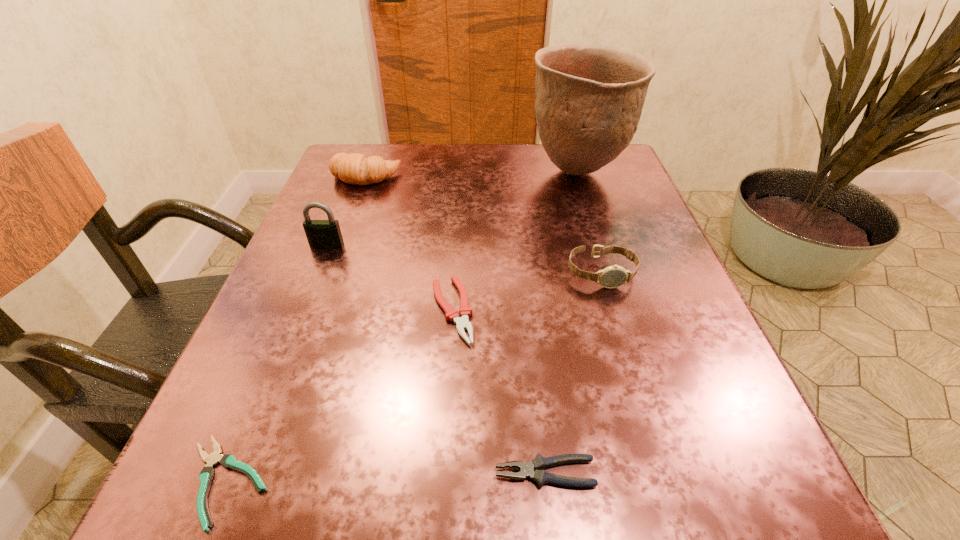
The width and height of the screenshot is (960, 540). In the image, there is a desktop. Find the location of `free space at the left edge`. free space at the left edge is located at coordinates (290, 318).

The width and height of the screenshot is (960, 540). In the image, there is a desktop. Identify the location of vacant space at the right edge. point(576,227).

The width and height of the screenshot is (960, 540). In the image, there is a desktop. Find the location of `vacant space at the far left corner`. vacant space at the far left corner is located at coordinates pyautogui.click(x=330, y=192).

Identify the location of vacant position at the far right corner of the desktop. (629, 192).

Locate an element on the screen. vacant region at the near right corner of the desktop is located at coordinates (746, 515).

The image size is (960, 540). What are the coordinates of `unoccupied area between the fourth shortest object and the third tallest object` in the screenshot? It's located at pyautogui.click(x=484, y=225).

Locate an element on the screen. The width and height of the screenshot is (960, 540). empty space that is in between the padlock and the fourth tallest object is located at coordinates (464, 259).

Locate an element on the screen. vacant area between the leftmost pliers and the crescent roll is located at coordinates (296, 329).

Where is `vacant point located between the shortest pliers and the second pliers from right to left`? The image size is (960, 540). vacant point located between the shortest pliers and the second pliers from right to left is located at coordinates (339, 396).

The image size is (960, 540). I want to click on free space that is in between the pottery and the shortest object, so click(401, 327).